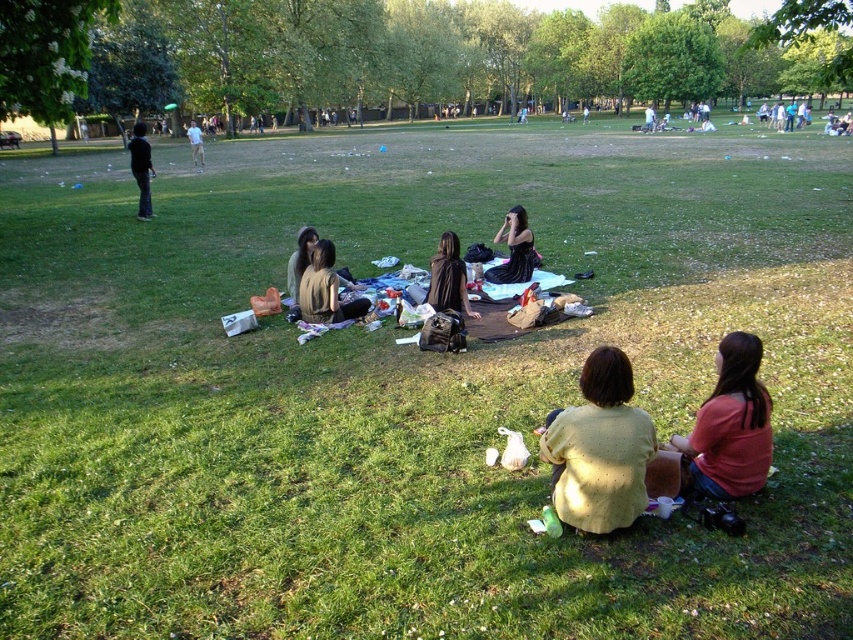
In the scene shown: You are a photographer trying to capture a group photo of the light yellow knit sweater at lower center and the matte brown shirt at center. Since you want to ensure both subjects are in focus, you need to know which one is taller. Can you tell me which one is taller?

The light yellow knit sweater at lower center is taller than the matte brown shirt at center, so you should adjust your camera settings to focus on the taller subject first.

You are organizing a picnic and need to decide which item to place under the umbrella first. The light yellow knit sweater at lower center and the pink fabric at lower right are both on the ground. Which item should you pick if you want to cover more area?

The light yellow knit sweater at lower center is bigger than the pink fabric at lower right, so you should pick the light yellow knit sweater at lower center to cover more area.

You are planning to place a small picnic basket between the pink fabric at lower right and the light brown leather jacket at upper left. Based on their positions, where should you place the basket?

The pink fabric at lower right is located below the light brown leather jacket at upper left, so you should place the basket between them by positioning it below the light brown leather jacket at upper left and above the pink fabric at lower right.